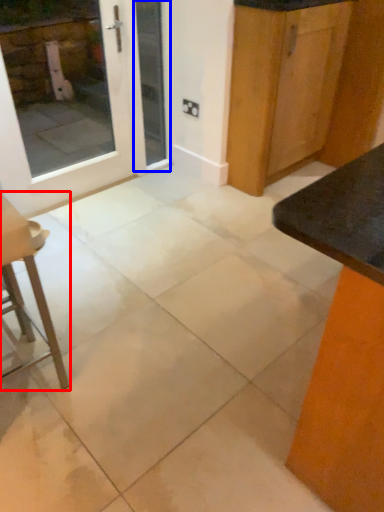
Question: Which object is further to the camera taking this photo, furniture (highlighted by a red box) or screen door (highlighted by a blue box)?

Choices:
 (A) furniture
 (B) screen door

Answer: (B)